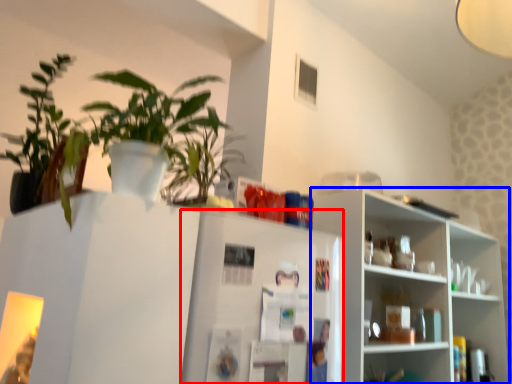
Question: Among these objects, which one is nearest to the camera, fridge (highlighted by a red box) or shelf (highlighted by a blue box)?

Choices:
 (A) fridge
 (B) shelf

Answer: (A)